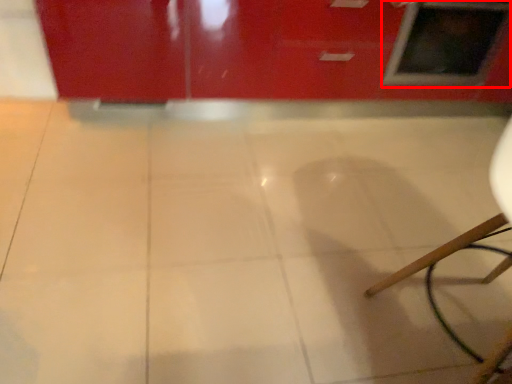
Question: Considering the relative positions of window (annotated by the red box) and ceramic tile in the image provided, where is window (annotated by the red box) located with respect to the staircase?

Choices:
 (A) left
 (B) right

Answer: (B)